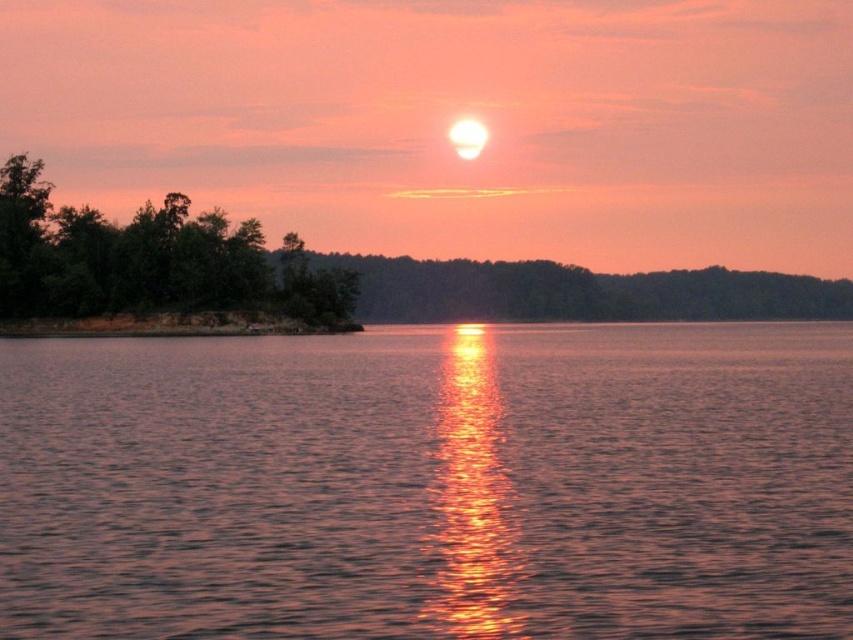
Question: Does shiny reflective water at center appear on the left side of green matte trees at left?

Choices:
 (A) no
 (B) yes

Answer: (A)

Question: Does shiny reflective water at center appear on the left side of green matte trees at left?

Choices:
 (A) yes
 (B) no

Answer: (B)

Question: In this image, where is shiny reflective water at center located relative to green matte trees at left?

Choices:
 (A) left
 (B) right

Answer: (B)

Question: Which point appears closest to the camera in this image?

Choices:
 (A) (3, 227)
 (B) (338, 376)

Answer: (B)

Question: Among these points, which one is nearest to the camera?

Choices:
 (A) 387,625
 (B) 318,323

Answer: (A)

Question: Which point is farther from the camera taking this photo?

Choices:
 (A) (672, 422)
 (B) (206, 294)

Answer: (B)